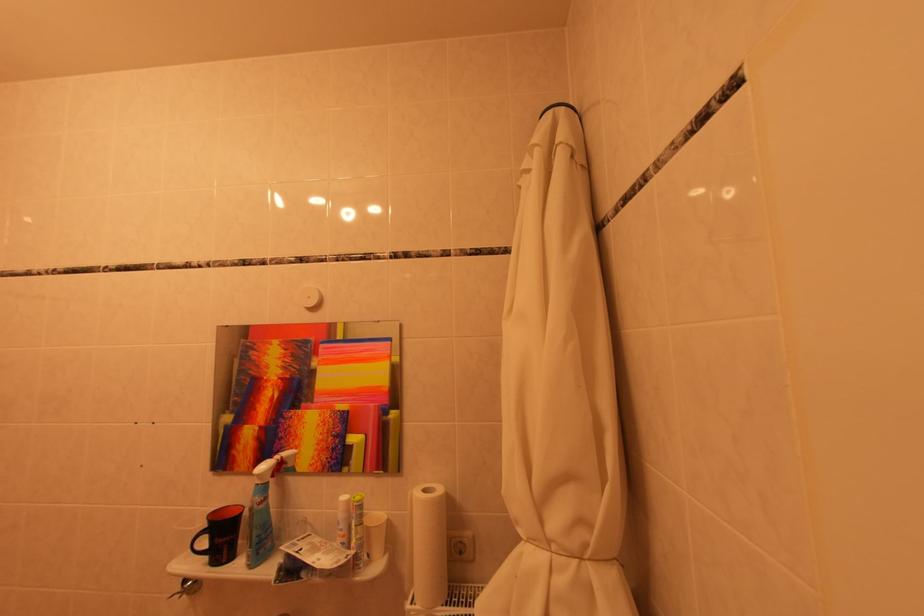
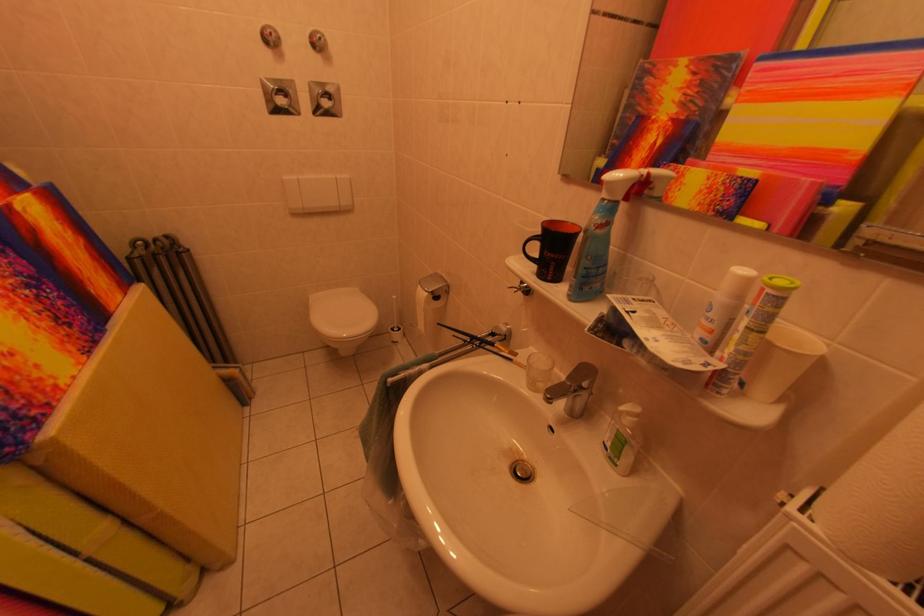
In the second image, find the point that corresponds to [371,528] in the first image.

(773, 336)